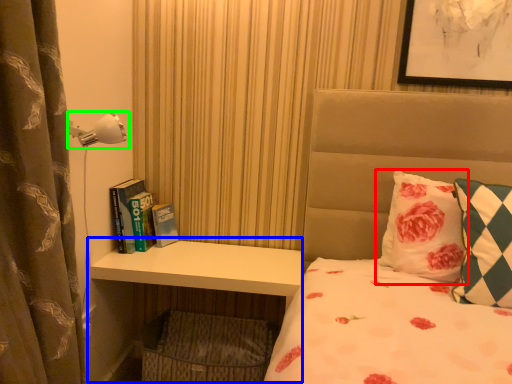
Question: Estimate the real-world distances between objects in this image. Which object is farther from pillow (highlighted by a red box), dresser (highlighted by a blue box) or lamp (highlighted by a green box)?

Choices:
 (A) dresser
 (B) lamp

Answer: (B)